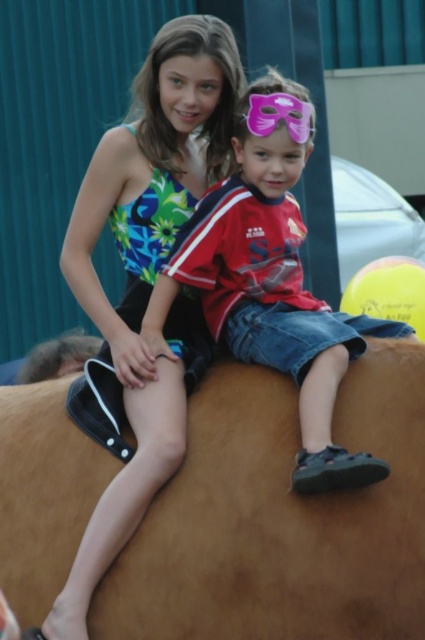
Can you confirm if brown leather horse at center is taller than multicolored fabric dress at upper left?

No.

Locate an element on the screen. The width and height of the screenshot is (425, 640). brown leather horse at center is located at coordinates (x=280, y=518).

Is point (197, 632) closer to camera compared to point (184, 323)?

Yes.

What are the coordinates of `brown leather horse at center` in the screenshot? It's located at (280, 518).

Who is more forward, (141, 262) or (303, 138)?

Point (303, 138) is in front.

Does point (138, 378) come in front of point (235, 323)?

Yes, point (138, 378) is closer to viewer.

The height and width of the screenshot is (640, 425). In order to click on multicolored fabric dress at upper left in this screenshot , I will do `click(144, 282)`.

Identify the location of multicolored fabric dress at upper left. (144, 282).

Between brown leather horse at center and matte red shirt at center, which one appears on the left side from the viewer's perspective?

matte red shirt at center

Is brown leather horse at center further to camera compared to matte red shirt at center?

That is True.

Which is in front, point (263, 429) or point (255, 291)?

Point (263, 429)

Locate an element on the screen. This screenshot has height=640, width=425. brown leather horse at center is located at coordinates (280, 518).